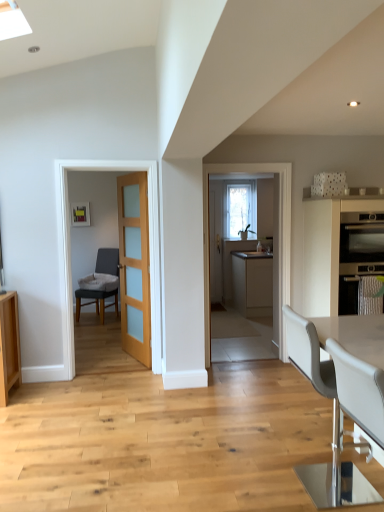
The width and height of the screenshot is (384, 512). What are the coordinates of `vacant region below white leather chair at lower right, placed as the second chair when sorted from front to back (from a real-world perspective)` in the screenshot? It's located at (321, 486).